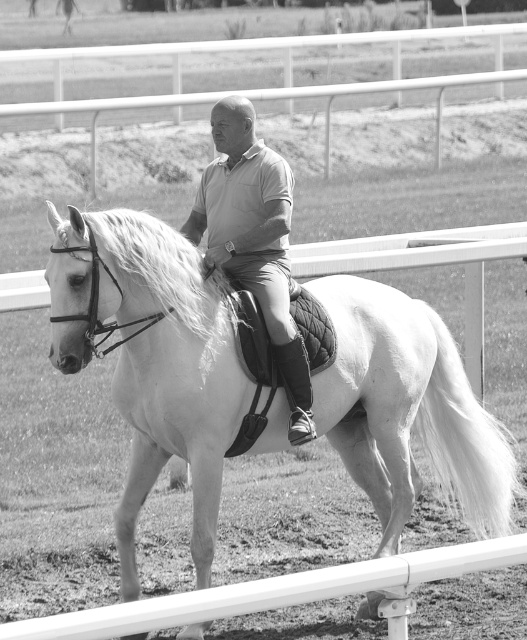
Identify the location of white matte/suede saddle at center. Image resolution: width=527 pixels, height=640 pixels. (152, 358).

What do you see at coordinates (152, 358) in the screenshot? The height and width of the screenshot is (640, 527). I see `white matte/suede saddle at center` at bounding box center [152, 358].

Does point (350, 305) lie in front of point (258, 304)?

No, (350, 305) is behind (258, 304).

This screenshot has height=640, width=527. I want to click on white matte/suede saddle at center, so click(152, 358).